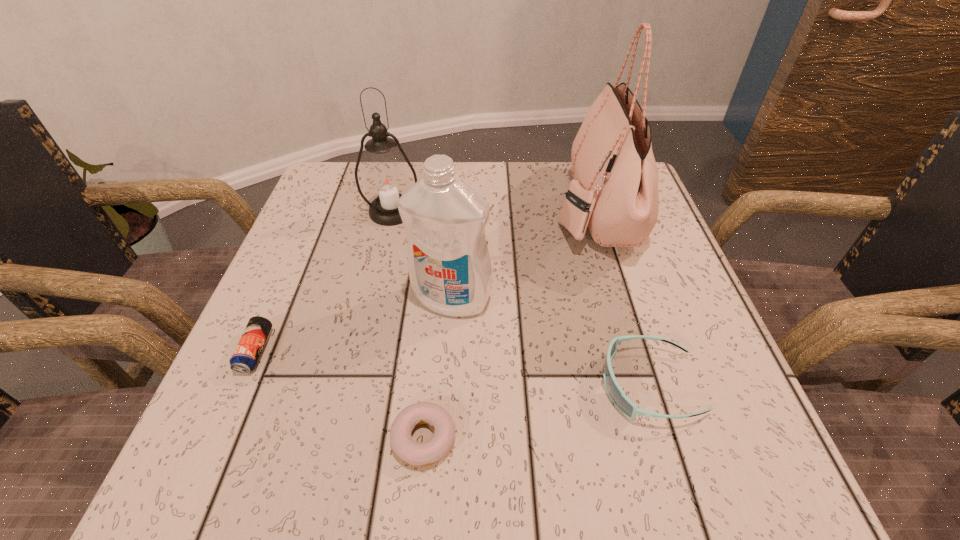
Where is `free spot between the goggles and the handbag`? This screenshot has width=960, height=540. free spot between the goggles and the handbag is located at coordinates (622, 297).

At what (x,y) coordinates should I click in order to perform the action: click on empty space that is in between the third shortest object and the doughnut. Please return your answer as a coordinate pair (x, y). Looking at the image, I should click on (537, 411).

Identify which object is the fifth closest to the second object from left to right. Please provide its 2D coordinates. Your answer should be formatted as a tuple, i.e. [(x, y)], where the tuple contains the x and y coordinates of a point satisfying the conditions above.

[(623, 403)]

At what (x,y) coordinates should I click in order to perform the action: click on the fifth closest object to the fifth object from right to left. Please return your answer as a coordinate pair (x, y). Image resolution: width=960 pixels, height=540 pixels. Looking at the image, I should click on (623, 403).

Identify the location of vacant space that satisfies the following two spatial constraints: 1. on the front side of the detergent; 2. on the right side of the oil lamp. (372, 299).

Locate an element on the screen. vacant space that satisfies the following two spatial constraints: 1. on the back side of the third farthest object; 2. on the left side of the doughnut is located at coordinates (437, 299).

I want to click on vacant space that satisfies the following two spatial constraints: 1. on the back side of the fourth nearest object; 2. on the left side of the doughnut, so click(x=437, y=299).